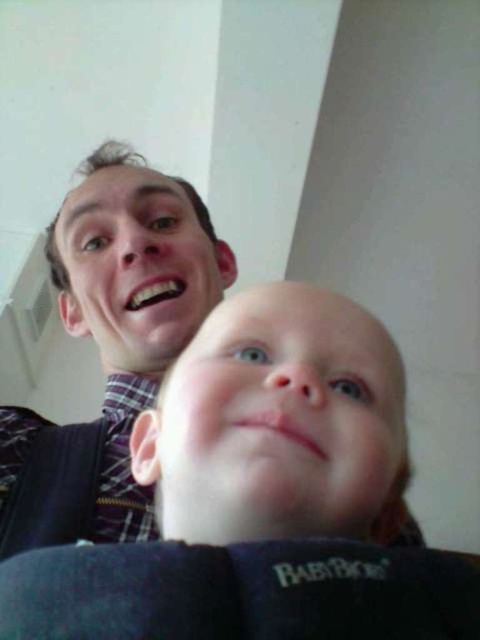
Is smooth skin baby at center to the left of matte plaid shirt at upper left from the viewer's perspective?

Incorrect, smooth skin baby at center is not on the left side of matte plaid shirt at upper left.

Which is more to the right, smooth skin baby at center or matte plaid shirt at upper left?

Positioned to the right is smooth skin baby at center.

This screenshot has width=480, height=640. In order to click on smooth skin baby at center in this screenshot , I will do `click(261, 497)`.